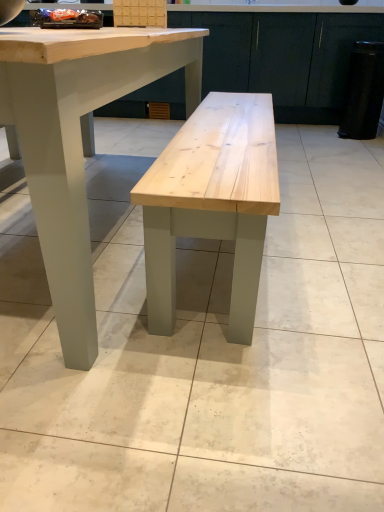
Question: Is matte wood cabinet at center inside the boundaries of natural wood table at center, or outside?

Choices:
 (A) outside
 (B) inside

Answer: (A)

Question: From the image's perspective, relative to natural wood table at center, is matte wood cabinet at center above or below?

Choices:
 (A) above
 (B) below

Answer: (A)

Question: From their relative heights in the image, would you say matte wood cabinet at center is taller or shorter than natural wood table at center?

Choices:
 (A) tall
 (B) short

Answer: (A)

Question: Is natural wood table at center taller or shorter than matte wood cabinet at center?

Choices:
 (A) short
 (B) tall

Answer: (A)

Question: Which is correct: natural wood table at center is inside matte wood cabinet at center, or outside of it?

Choices:
 (A) inside
 (B) outside

Answer: (B)

Question: Is point (97, 106) positioned closer to the camera than point (362, 32)?

Choices:
 (A) farther
 (B) closer

Answer: (B)

Question: From a real-world perspective, relative to matte wood cabinet at center, is natural wood table at center vertically above or below?

Choices:
 (A) above
 (B) below

Answer: (B)